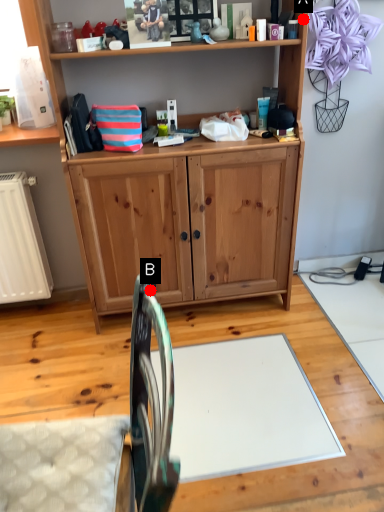
Question: Two points are circled on the image, labeled by A and B beside each circle. Which point is closer to the camera taking this photo?

Choices:
 (A) A is closer
 (B) B is closer

Answer: (B)